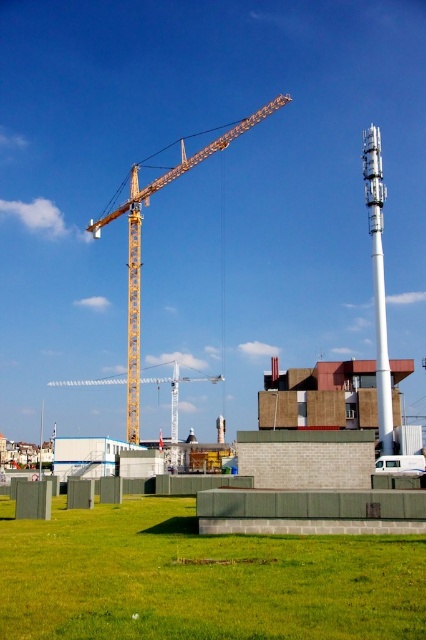
Locate an element on the screen. green grass at lower center is located at coordinates (199, 579).

Looking at this image, is green grass at lower center thinner than white matte van at lower right?

In fact, green grass at lower center might be wider than white matte van at lower right.

Who is more forward, (354, 618) or (416, 465)?

Point (354, 618) is more forward.

Find the location of `green grass at lower center`. green grass at lower center is located at coordinates (199, 579).

In the scene shown: Is green grass at lower center above yellow metallic crane at upper center?

Actually, green grass at lower center is below yellow metallic crane at upper center.

Between green grass at lower center and yellow metallic crane at upper center, which one has more height?

yellow metallic crane at upper center

Which is in front, point (268, 538) or point (135, 364)?

Point (268, 538)

Identify the location of green grass at lower center. (199, 579).

Is yellow metallic crane at upper center in front of white matte van at lower right?

No, yellow metallic crane at upper center is further to the viewer.

Does point (199, 156) come farther from viewer compared to point (400, 460)?

That is True.

Where is `yellow metallic crane at upper center`? This screenshot has width=426, height=640. yellow metallic crane at upper center is located at coordinates (140, 243).